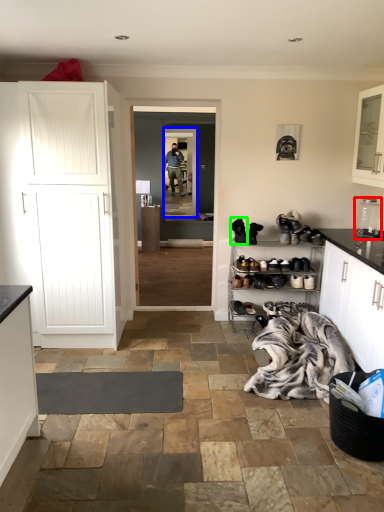
Question: Based on their relative distances, which object is farther from appliance (highlighted by a red box)? Choose from glass door (highlighted by a blue box) and footwear (highlighted by a green box).

Choices:
 (A) glass door
 (B) footwear

Answer: (A)